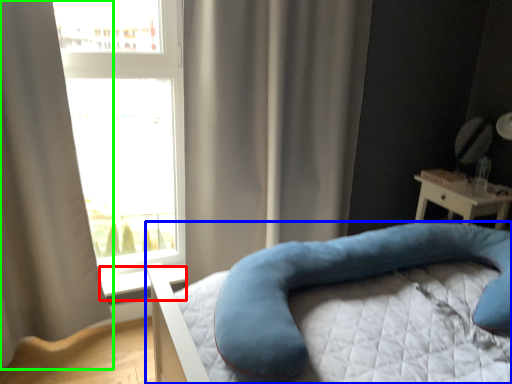
Question: Which object is positioned closest to window sill (highlighted by a red box)? Select from bed (highlighted by a blue box) and curtain (highlighted by a green box).

Choices:
 (A) bed
 (B) curtain

Answer: (B)